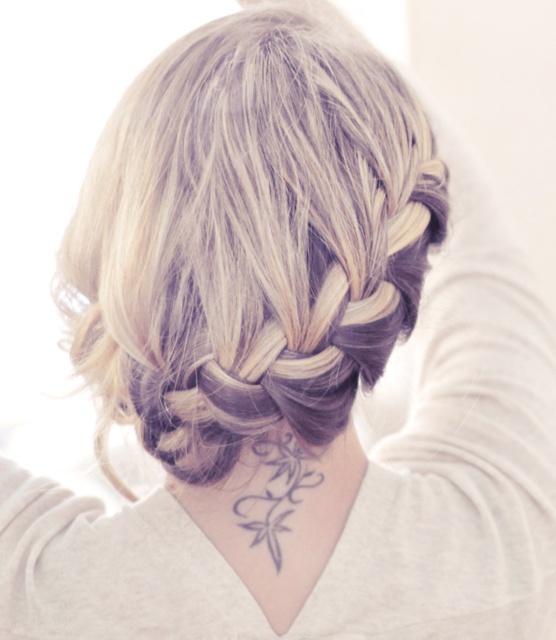
Question: Which object is closer to the camera taking this photo?

Choices:
 (A) gray ink floral design at center back
 (B) black tattoo at center

Answer: (B)

Question: Considering the relative positions of black tattoo at center and gray ink floral design at center back in the image provided, where is black tattoo at center located with respect to gray ink floral design at center back?

Choices:
 (A) left
 (B) right

Answer: (A)

Question: From the image, what is the correct spatial relationship of black tattoo at center in relation to gray ink floral design at center back?

Choices:
 (A) above
 (B) below

Answer: (A)

Question: In this image, where is black tattoo at center located relative to gray ink floral design at center back?

Choices:
 (A) below
 (B) above

Answer: (B)

Question: Which point appears closest to the camera in this image?

Choices:
 (A) (311, 468)
 (B) (271, 564)

Answer: (B)

Question: Which point is closer to the camera?

Choices:
 (A) gray ink floral design at center back
 (B) black tattoo at center

Answer: (B)